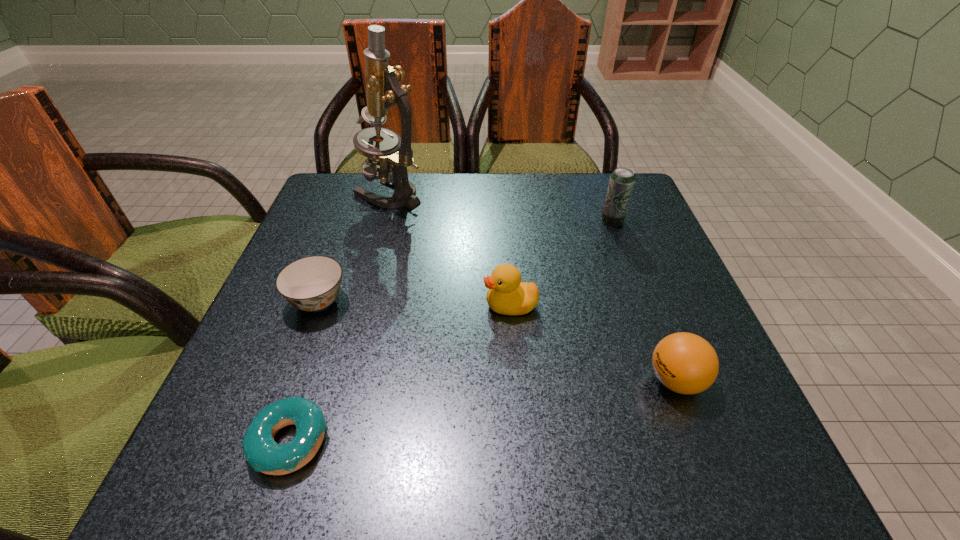
You are a GUI agent. You are given a task and a screenshot of the screen. Output one action in this format:
    pyautogui.click(x=<x>, y=<y>)
    Task: Click on the beer can that is at the far edge
    
    Given the screenshot: What is the action you would take?
    pyautogui.click(x=621, y=182)

The height and width of the screenshot is (540, 960). I want to click on object present at the near edge, so click(x=264, y=455).

This screenshot has width=960, height=540. I want to click on microscope at the left edge, so click(394, 154).

The image size is (960, 540). Find the location of `soup bowl located at the left edge`. soup bowl located at the left edge is located at coordinates (312, 283).

The height and width of the screenshot is (540, 960). What are the coordinates of `doughnut present at the left edge` in the screenshot? It's located at (264, 455).

Locate an element on the screen. beer can that is positioned at the right edge is located at coordinates (621, 182).

This screenshot has width=960, height=540. Identify the location of ping-pong ball that is at the right edge. (685, 363).

The image size is (960, 540). Identify the location of object situated at the far left corner. (394, 154).

Where is `object located in the near left corner section of the desktop`? Image resolution: width=960 pixels, height=540 pixels. object located in the near left corner section of the desktop is located at coordinates click(264, 455).

The width and height of the screenshot is (960, 540). In order to click on object at the far right corner in this screenshot , I will do (621, 182).